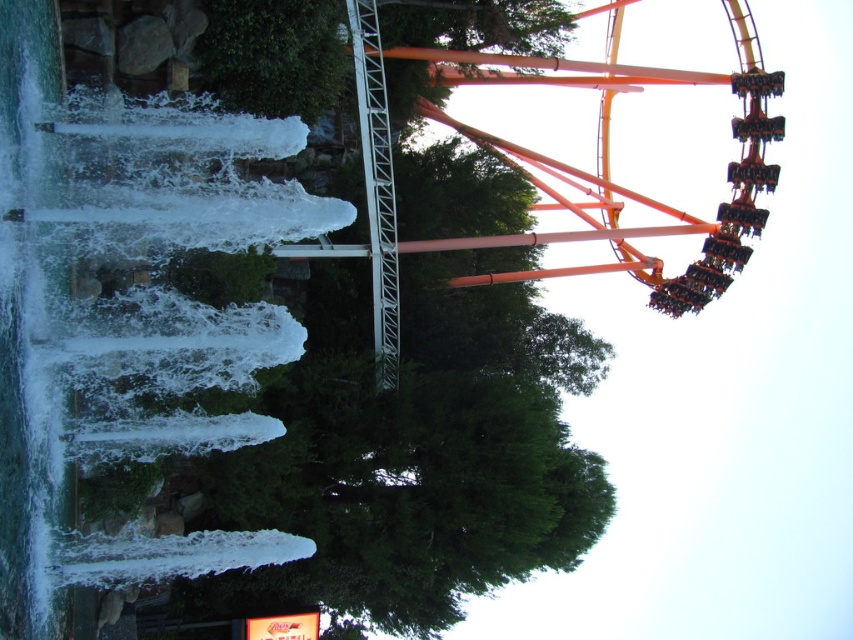
You are a visitor at the amusement park and want to take a photo of both the green leafy tree at center and the orange metallic roller coaster at upper right. Based on their positions, which object should you focus on first to ensure both are in the frame?

The green leafy tree at center is below the orange metallic roller coaster at upper right, so you should focus on the orange metallic roller coaster at upper right first to ensure both are in the frame.

You are a visitor at the amusement park and want to take a photo of both the green leafy tree at center and the orange metallic roller coaster at upper right. From your current position, which object should you position to your left to include both in the frame?

You should position the green leafy tree at center to your left since it is already to the left of the orange metallic roller coaster at upper right.

You are planning to take a photo of the green leafy tree at center and the orange metallic roller coaster at upper right. Which object should you focus on first if you want to capture both in the frame without moving the camera?

The green leafy tree at center is wider than the orange metallic roller coaster at upper right, so you should focus on the green leafy tree at center first to ensure it fits in the frame.